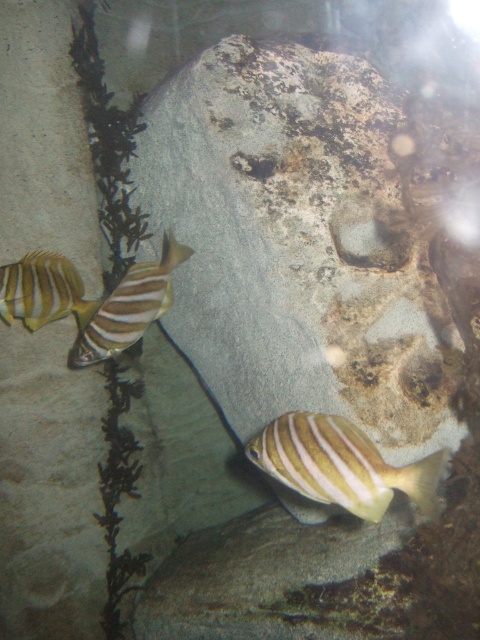
You are an underwater photographer aiming to capture a photo of both the yellow striped fish at lower center and the shiny yellow fish at left. Since you can only focus on one fish at a time, which fish should you focus on first if you want to ensure both are in the frame?

You should focus on the shiny yellow fish at left first because the yellow striped fish at lower center is positioned to its right, meaning both can be captured by adjusting the camera to include both from left to right.

You are a marine biologist observing an underwater scene. You need to capture a closeup photo of the yellow striped fish at lower center. Your camera has a maximum focus range of 1.5 meters. Can you take the photo without moving closer?

The yellow striped fish at lower center is 1.45 meters away from the camera. Since the maximum focus range is 1.5 meters, the camera can focus on the fish at that distance. Therefore, you can take the closeup photo without moving closer.